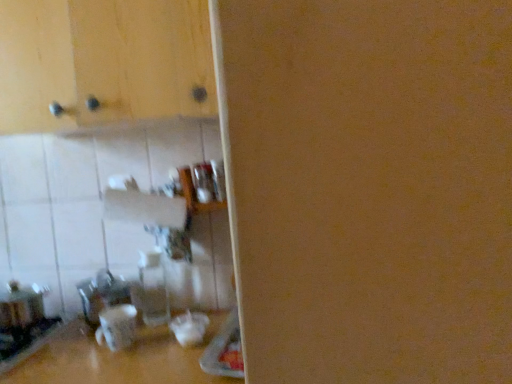
Question: Can we say metallic silver toaster at lower left lies outside matte wood cabinet at upper left?

Choices:
 (A) yes
 (B) no

Answer: (A)

Question: Is metallic silver toaster at lower left far from matte wood cabinet at upper left?

Choices:
 (A) yes
 (B) no

Answer: (B)

Question: Is metallic silver toaster at lower left bigger than matte wood cabinet at upper left?

Choices:
 (A) yes
 (B) no

Answer: (B)

Question: Can you confirm if metallic silver toaster at lower left is wider than matte wood cabinet at upper left?

Choices:
 (A) yes
 (B) no

Answer: (B)

Question: Is metallic silver toaster at lower left to the left of matte wood cabinet at upper left from the viewer's perspective?

Choices:
 (A) yes
 (B) no

Answer: (A)

Question: Is metallic silver toaster at lower left smaller than matte wood cabinet at upper left?

Choices:
 (A) no
 (B) yes

Answer: (B)

Question: Is transparent glass bottle at center at the back of metallic silver toaster at lower left?

Choices:
 (A) no
 (B) yes

Answer: (A)

Question: Can you confirm if metallic silver toaster at lower left is bigger than transparent glass bottle at center?

Choices:
 (A) no
 (B) yes

Answer: (B)

Question: From the image's perspective, is metallic silver toaster at lower left below transparent glass bottle at center?

Choices:
 (A) no
 (B) yes

Answer: (B)

Question: From a real-world perspective, is metallic silver toaster at lower left positioned under transparent glass bottle at center based on gravity?

Choices:
 (A) no
 (B) yes

Answer: (B)

Question: Does metallic silver toaster at lower left have a greater width compared to transparent glass bottle at center?

Choices:
 (A) no
 (B) yes

Answer: (B)

Question: From the image's perspective, is metallic silver toaster at lower left located above transparent glass bottle at center?

Choices:
 (A) no
 (B) yes

Answer: (A)

Question: Is metallic silver toaster at lower left surrounded by transparent glass bottle at center?

Choices:
 (A) no
 (B) yes

Answer: (A)